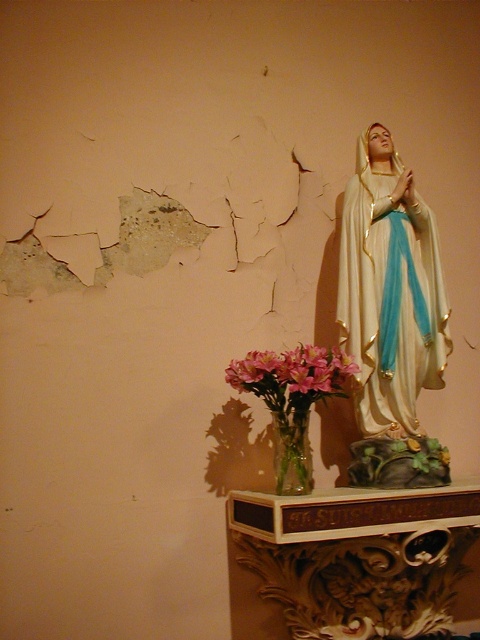
You are a florist arranging flowers for a religious event. You have two vases, the pink glass vase at lower center and the clear glass vase at lower center. The event requires placing flowers in the vase that is closer to the statue of the Virgin Mary. Which vase should you choose?

The pink glass vase at lower center is closer to the statue of the Virgin Mary than the clear glass vase at lower center because the distance between them is 4.81 inches.

You are an interior designer planning to place both the white glossy statue at upper right and the clear glass vase at lower center on a shelf. The shelf has a maximum weight capacity of 10 kilograms. If the statue weighs 8 kilograms and the vase weighs 1.5 kilograms, can both items be placed on the shelf together without exceeding the weight limit?

The white glossy statue at upper right weighs 8 kilograms and the clear glass vase at lower center weighs 1.5 kilograms. Combined, they total 9.5 kilograms, which is under the 10 kilogram limit. Therefore, both items can be placed on the shelf together without exceeding the weight limit.